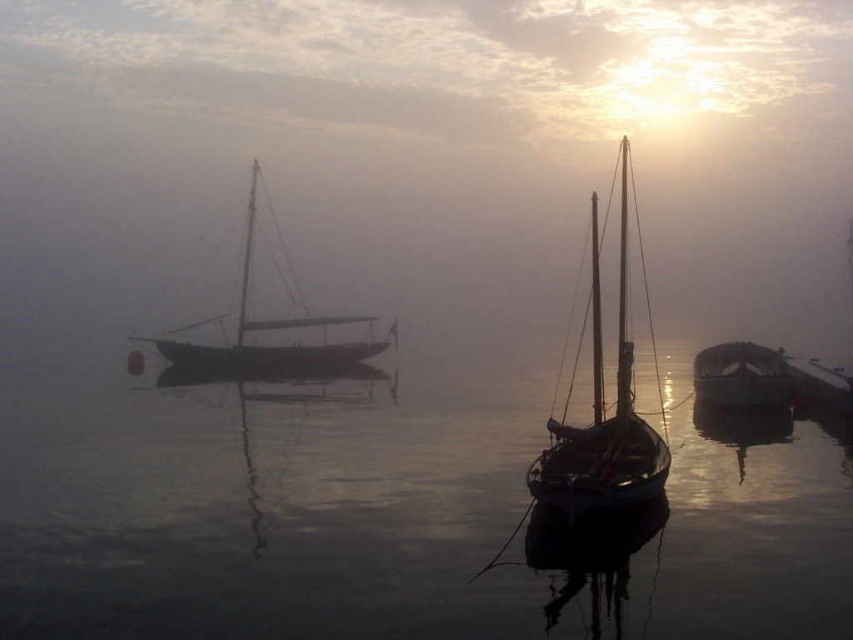
You are an observer standing on the shore looking at the scene. Which object, the transparent water at center or the shiny dark wood boat at right, is positioned lower in the image?

The transparent water at center is positioned lower than the shiny dark wood boat at right in the image.

Consider the image. You are standing on the shore observing two points marked in the scene. The first point is at coordinates point (1, 385) and the second point is at point (279, 355). Which point is closer to you?

Point (1, 385) is in front of point (279, 355), so it is closer to you.

You are a photographer planning to capture the wooden sailboat at left and the transparent water at center in a single frame. Given that the camera can only focus on objects within a 10 meter width, will both objects fit within the frame?

The transparent water at center has a width less than the wooden sailboat at left, so the total width of both objects combined may still be within the camera frame limit. However, without knowing the exact width of the wooden sailboat at left, it is impossible to confirm if both will fit within the 10 meter width requirement.